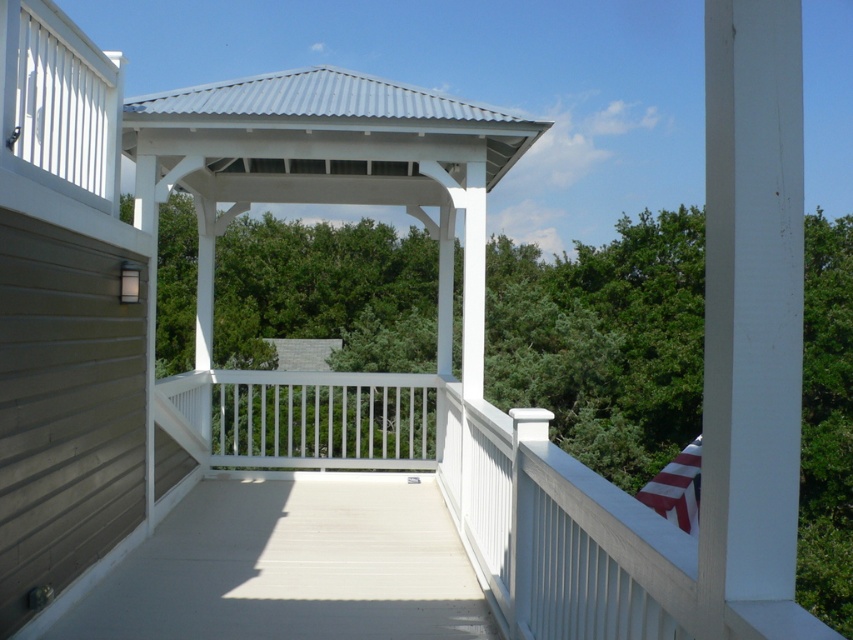
Question: Where is white painted wood balustrade at center located in relation to striped fabric flag at lower right in the image?

Choices:
 (A) below
 (B) above

Answer: (B)

Question: Which of the following is the closest to the observer?

Choices:
 (A) white matte deck at center
 (B) white painted wood balustrade at center

Answer: (A)

Question: Which point appears closest to the camera in this image?

Choices:
 (A) (688, 483)
 (B) (390, 413)
 (C) (310, 520)

Answer: (C)

Question: Considering the relative positions of white painted wood balustrade at center and striped fabric flag at lower right in the image provided, where is white painted wood balustrade at center located with respect to striped fabric flag at lower right?

Choices:
 (A) below
 (B) above

Answer: (B)

Question: Is white matte deck at center below striped fabric flag at lower right?

Choices:
 (A) no
 (B) yes

Answer: (A)

Question: Which point is farther to the camera?

Choices:
 (A) white matte deck at center
 (B) striped fabric flag at lower right
 (C) white painted wood balustrade at center

Answer: (B)